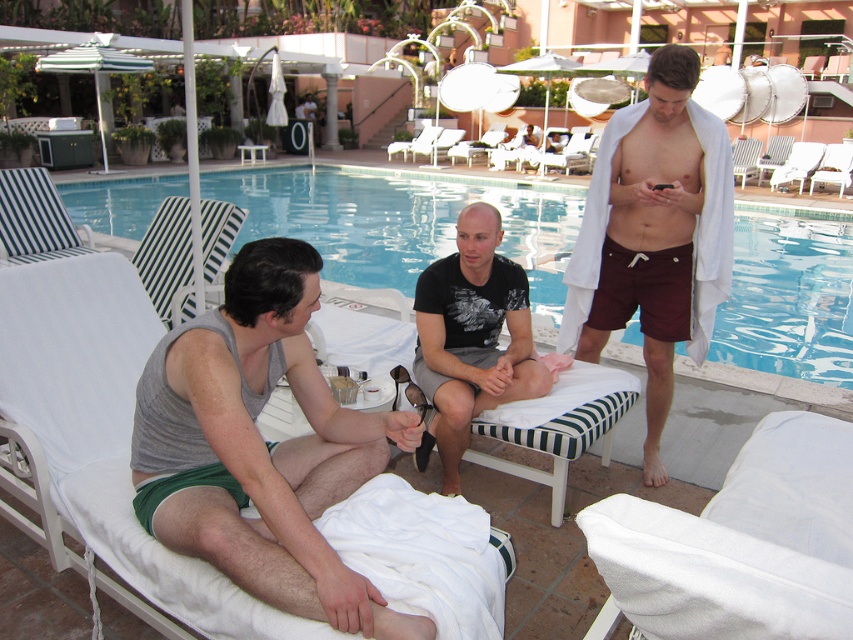
Question: Is blue tile swimming pool at center to the left of black matte t-shirt at center from the viewer's perspective?

Choices:
 (A) no
 (B) yes

Answer: (B)

Question: Estimate the real-world distances between objects in this image. Which object is farther from the black matte t-shirt at center?

Choices:
 (A) blue tile swimming pool at center
 (B) gray tank top at center
 (C) maroon fabric shorts at right

Answer: (A)

Question: Does maroon fabric shorts at right have a lesser width compared to black matte t-shirt at center?

Choices:
 (A) yes
 (B) no

Answer: (B)

Question: From the image, what is the correct spatial relationship of maroon fabric shorts at right in relation to black matte t-shirt at center?

Choices:
 (A) below
 (B) above

Answer: (B)

Question: Among these points, which one is farthest from the camera?

Choices:
 (A) (610, 268)
 (B) (223, 195)

Answer: (B)

Question: Which of the following is the closest to the observer?

Choices:
 (A) maroon fabric shorts at right
 (B) black matte t-shirt at center
 (C) blue tile swimming pool at center
 (D) gray tank top at center

Answer: (D)